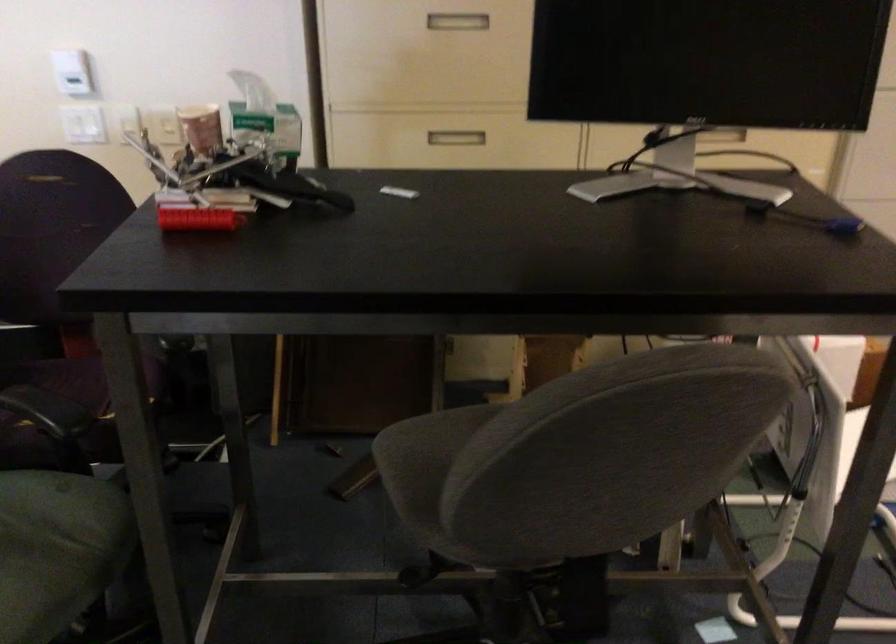
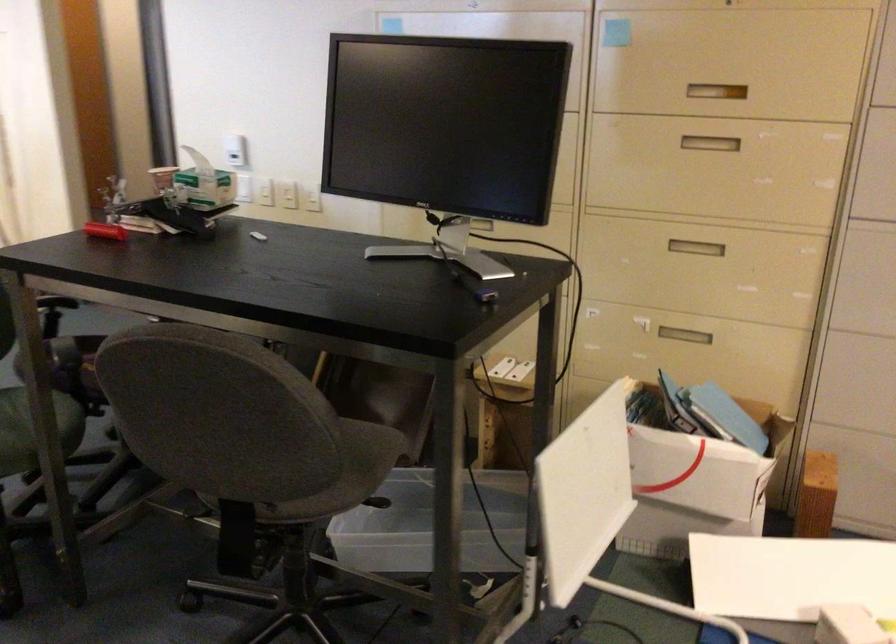
Locate, in the second image, the point that corresponds to point (725, 137) in the first image.

(695, 247)